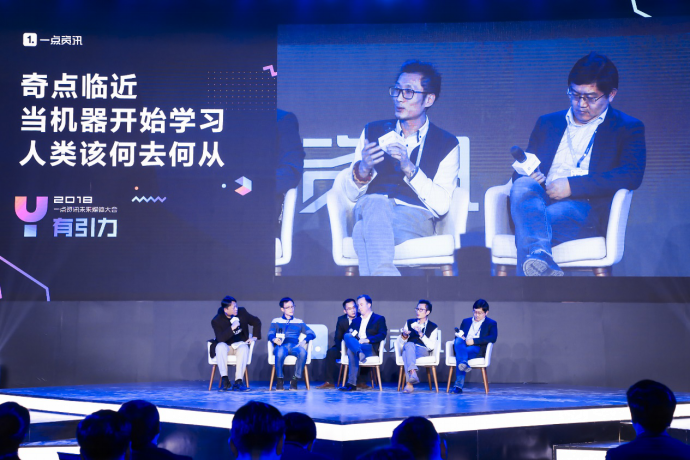
Identify the location of floor. (404, 400).